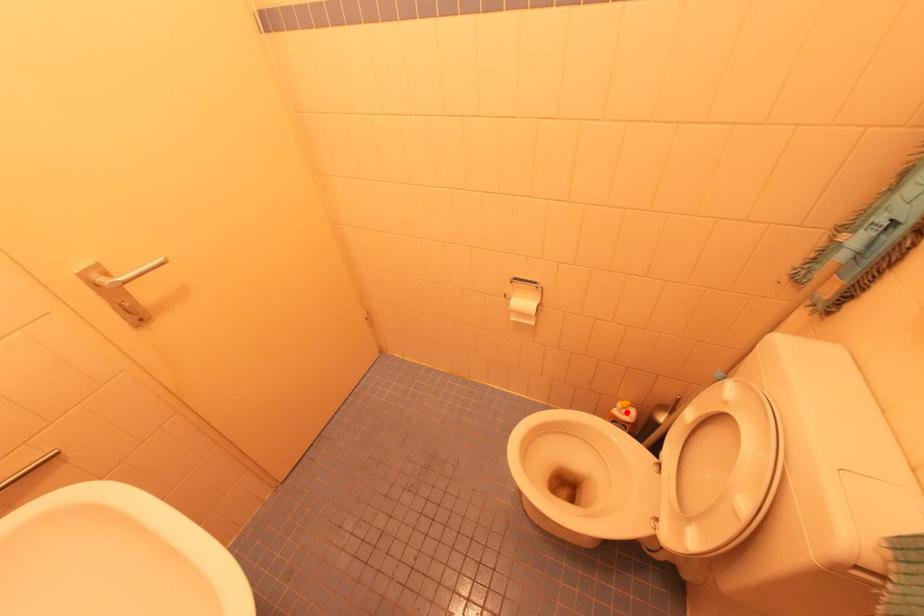
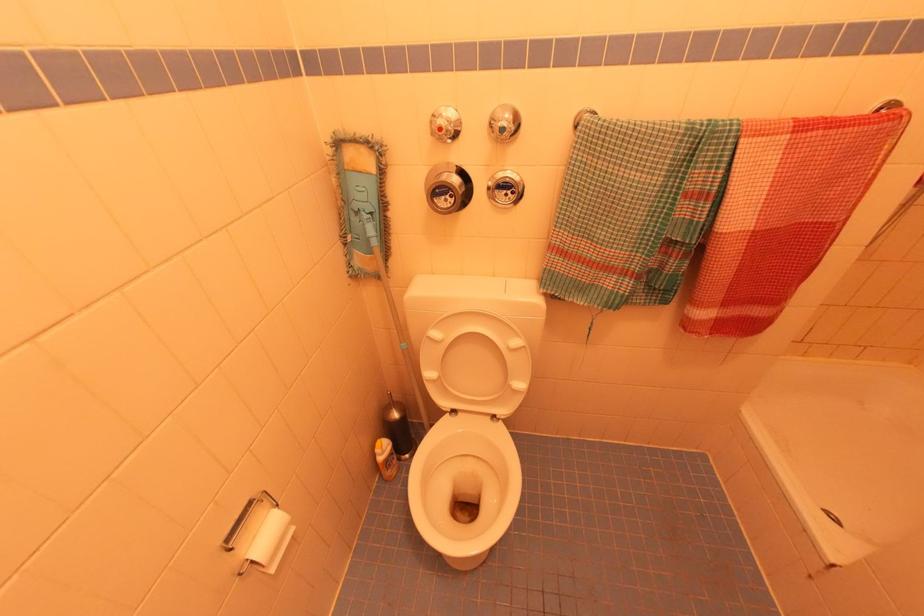
Question: I am providing you with two images of the same scene from different viewpoints. A red point is marked on the first image. Can you still see the location of the red point in image 2?

Choices:
 (A) Yes
 (B) No

Answer: (A)